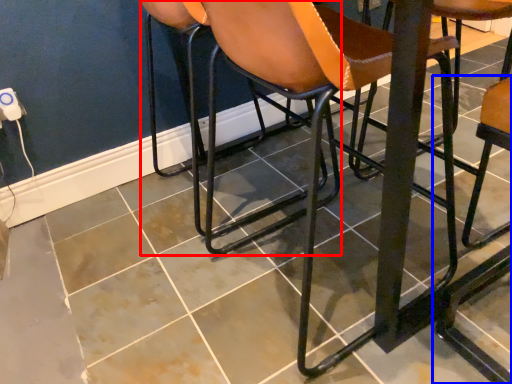
Question: Among these objects, which one is farthest to the camera, chair (highlighted by a red box) or chair (highlighted by a blue box)?

Choices:
 (A) chair
 (B) chair

Answer: (A)